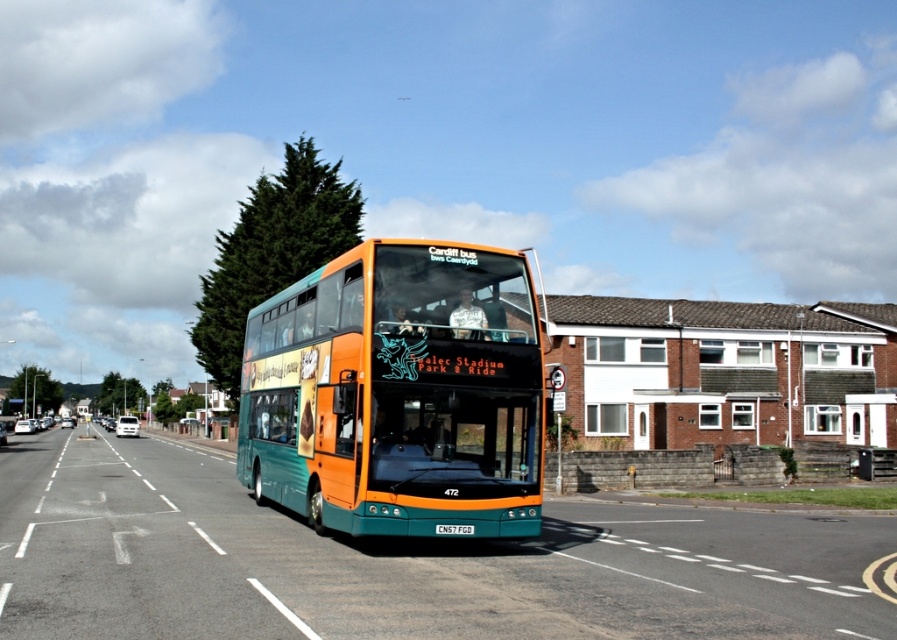
Who is positioned more to the left, teal glossy bus at center or white plastic license plate at center?

Positioned to the left is teal glossy bus at center.

Between point (425, 371) and point (466, 529), which one is positioned in front?

Point (466, 529) is more forward.

This screenshot has height=640, width=897. In order to click on teal glossy bus at center in this screenshot , I will do `click(397, 394)`.